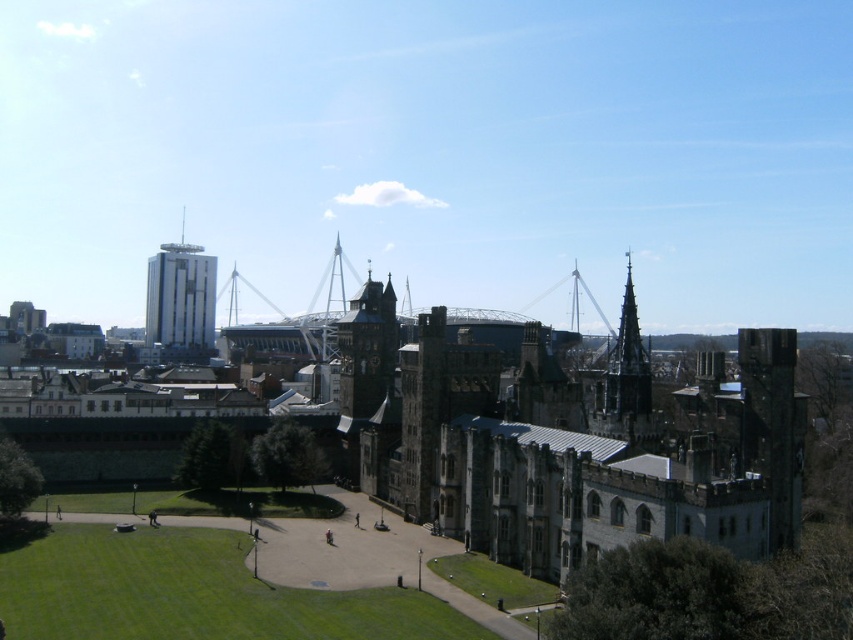
You are an architect visiting the historical site and want to take a photo that includes both the gray stone castle at center and the dark gray stone spire at upper right. Based on their positions, which object should you position closer to the left side of your camera frame?

The gray stone castle at center should be positioned closer to the left side of your camera frame since it is located to the left of the dark gray stone spire at upper right in the scene.

You are an architect analyzing the spatial relationship between the gray stone castle at center and the dark gray stone spire at upper right. Which object is located higher in the image?

The dark gray stone spire at upper right is positioned higher in the image than the gray stone castle at center.

You are a drone operator who needs to fly a drone from the gray stone castle at center to the shiny silver spire at center. Considering the height of both structures, will the drone need to ascend or descend to reach the destination?

The gray stone castle at center is not as tall as shiny silver spire at center, so the drone will need to ascend to reach the shiny silver spire at center from the gray stone castle at center.